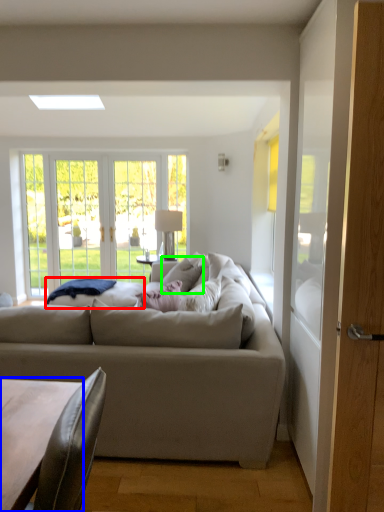
Question: Which object is positioned farthest from wide (highlighted by a red box)? Select from coffee table (highlighted by a blue box) and pillow (highlighted by a green box).

Choices:
 (A) coffee table
 (B) pillow

Answer: (A)